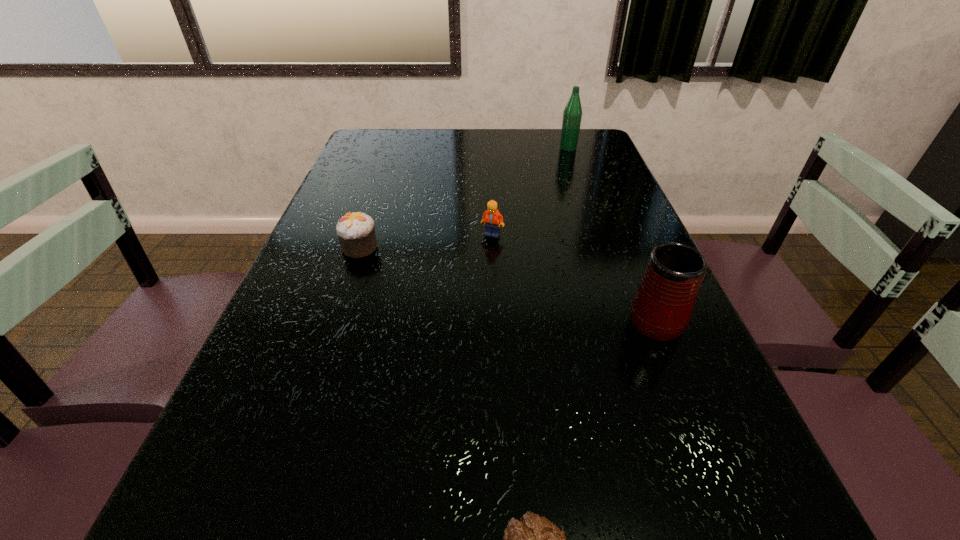
Where is `vacant space situated 0.070m on the front-facing side of the Lego`? Image resolution: width=960 pixels, height=540 pixels. vacant space situated 0.070m on the front-facing side of the Lego is located at coordinates (493, 255).

What are the coordinates of `vacant region located 0.380m on the back of the leftmost object` in the screenshot? It's located at (387, 167).

Identify the location of object that is at the far edge. 572,115.

This screenshot has width=960, height=540. Identify the location of object that is positioned at the left edge. point(356,232).

Locate an element on the screen. bottle present at the right edge is located at coordinates (572, 115).

You are a GUI agent. You are given a task and a screenshot of the screen. Output one action in this format:
    pyautogui.click(x=<x>, y=<y>)
    Task: Click on the mug located in the right edge section of the desktop
    
    Given the screenshot: What is the action you would take?
    pyautogui.click(x=661, y=308)

The image size is (960, 540). What are the coordinates of `object located in the far right corner section of the desktop` in the screenshot? It's located at (572, 115).

I want to click on vacant area at the far edge, so click(476, 129).

The height and width of the screenshot is (540, 960). What are the coordinates of `free space at the near edge of the desktop` in the screenshot? It's located at (636, 537).

In the image, there is a desktop. Where is `vacant region at the left edge`? Image resolution: width=960 pixels, height=540 pixels. vacant region at the left edge is located at coordinates (252, 367).